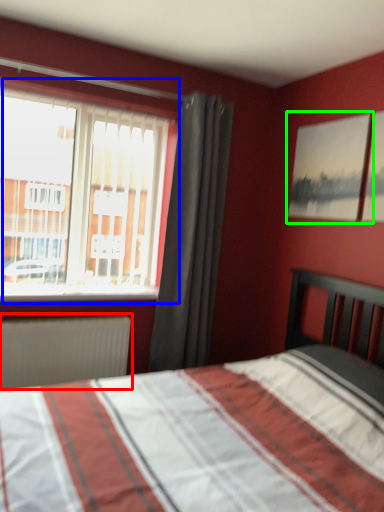
Question: Which object is the closest to the radiator (highlighted by a red box)? Choose among these: window (highlighted by a blue box) or picture frame (highlighted by a green box).

Choices:
 (A) window
 (B) picture frame

Answer: (A)